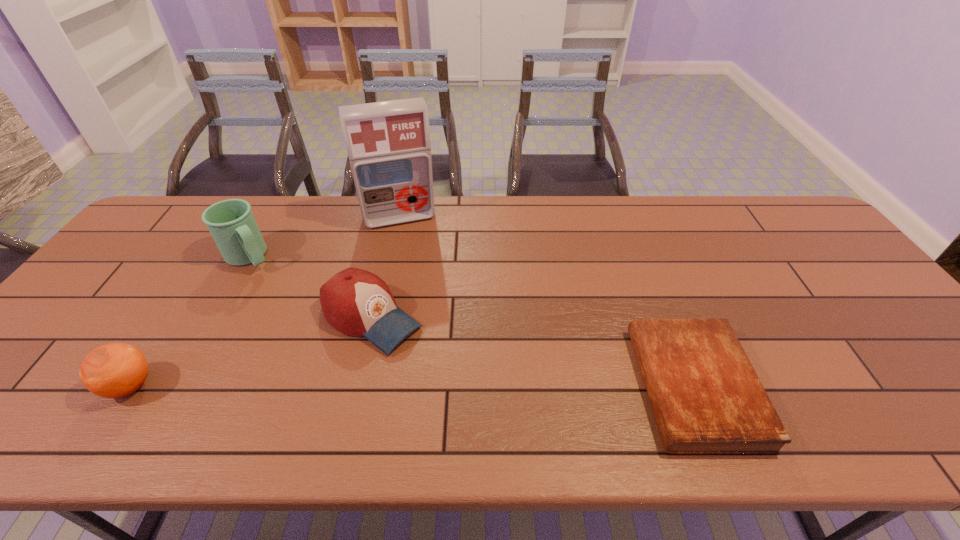
You are a GUI agent. You are given a task and a screenshot of the screen. Output one action in this format:
    pyautogui.click(x=<x>, y=<y>)
    Task: Click on the orange
    Image resolution: width=960 pixels, height=540 pixels.
    Given the screenshot: What is the action you would take?
    pyautogui.click(x=115, y=370)

The width and height of the screenshot is (960, 540). What are the coordinates of `the shortest object` in the screenshot? It's located at (706, 397).

Image resolution: width=960 pixels, height=540 pixels. In order to click on Bible in this screenshot , I will do `click(706, 397)`.

You are a GUI agent. You are given a task and a screenshot of the screen. Output one action in this format:
    pyautogui.click(x=<x>, y=<y>)
    Task: Click on the mug
    This screenshot has width=960, height=540.
    Given the screenshot: What is the action you would take?
    pyautogui.click(x=231, y=223)

Find the location of a particular element. The width and height of the screenshot is (960, 540). the second tallest object is located at coordinates (231, 223).

The image size is (960, 540). What are the coordinates of `baseball cap` in the screenshot? It's located at (356, 302).

This screenshot has width=960, height=540. I want to click on the farthest object, so click(x=388, y=143).

Find the location of a particular element. the first-aid kit is located at coordinates (388, 143).

I want to click on free space located on the right of the orange, so click(x=296, y=386).

Identify the location of free region located 0.390m on the spine side of the Bible. (468, 387).